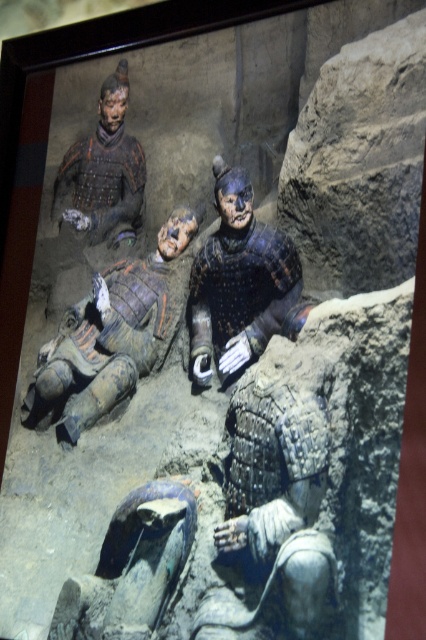
You are a tour guide explaining the Terracotta Warriors exhibit. You want to point out the matte painted figure at center to your visitors. What coordinates should you use to accurately indicate its location?

The matte painted figure at center is located at coordinates point (109, 336).

You are a museum guide explaining the Terracotta Warriors to a group of visitors. You point out the matte painted figure at center and the shiny metallic armor at upper left. Which one do you tell them is taller?

The matte painted figure at center is much taller than the shiny metallic armor at upper left.

You are a museum visitor standing in front of the Terracotta Warriors exhibit. You notice a point marked at coordinates (109, 336). Which object in the exhibit is located at this point?

The point at (109, 336) marks the location of the matte painted figure at center.